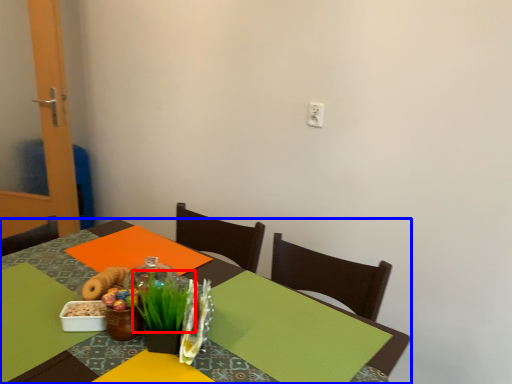
Question: Which object is closer to the camera taking this photo, grass (highlighted by a red box) or table (highlighted by a blue box)?

Choices:
 (A) grass
 (B) table

Answer: (B)